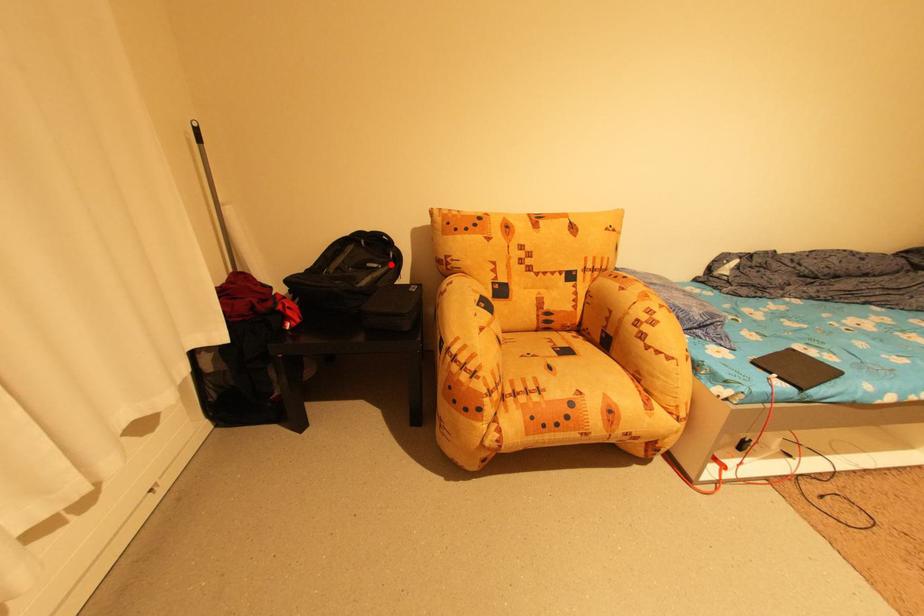
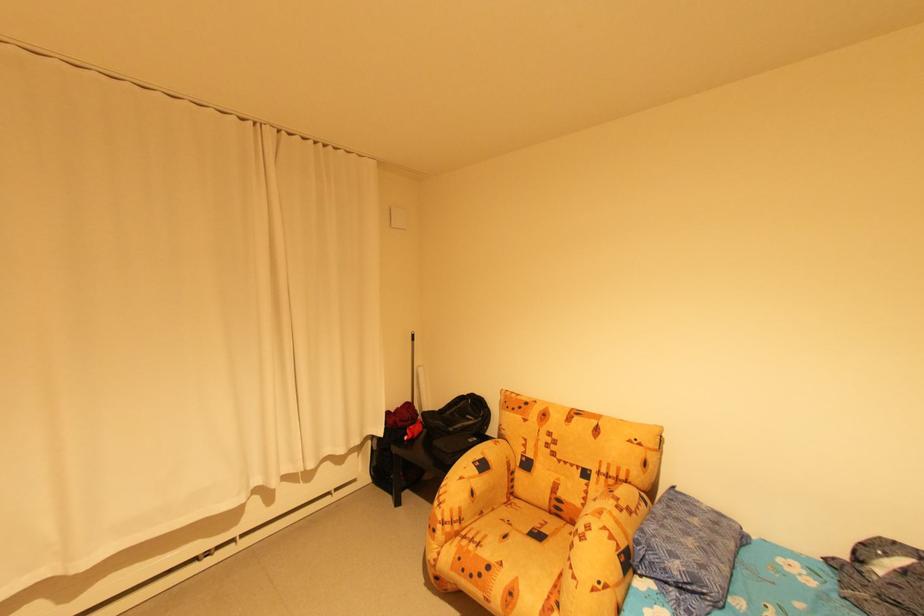
Question: A red point is marked in image1. In image2, is the corresponding 3D point closer to the camera or farther? Reply with the corresponding letter.

Choices:
 (A) The corresponding 3D point is closer.
 (B) The corresponding 3D point is farther.

Answer: (B)